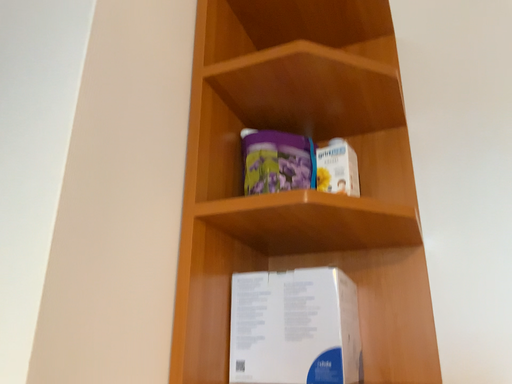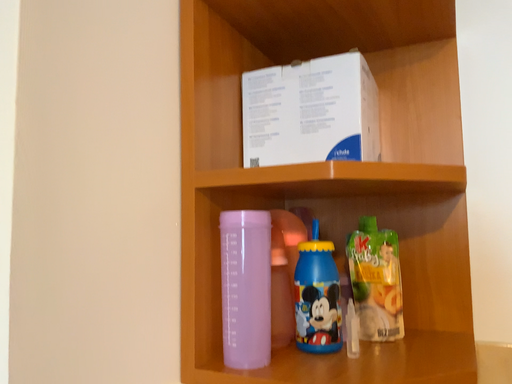
Question: Which way did the camera rotate in the video?

Choices:
 (A) rotated upward
 (B) rotated downward

Answer: (B)